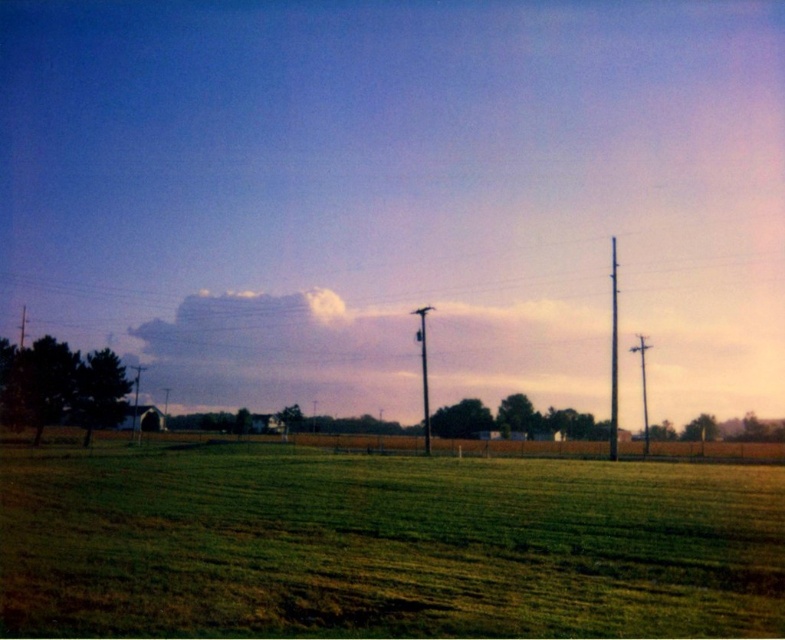
From the picture: You are a farmer checking the height of crops in your field. You notice the green grassy field at center and the metallic gray pole at right. Which object is taller?

The metallic gray pole at right is taller than the green grassy field at center.

You are standing in the rural landscape and want to walk from the green grassy field at center to the metallic gray pole at right. Which direction should you move to get closer to the pole?

Since the green grassy field at center is closer to the viewer than the metallic gray pole at right, you should move forward in the direction of the pole to get closer to it.

You are standing in the rural landscape and want to walk towards the wooden fence. There are two points marked as point (612, 360) and point (411, 310) in the scene. Which point should you head towards to reach the fence first?

You should head towards point (612, 360) because it is in front of point (411, 310), meaning it is closer to the fence.